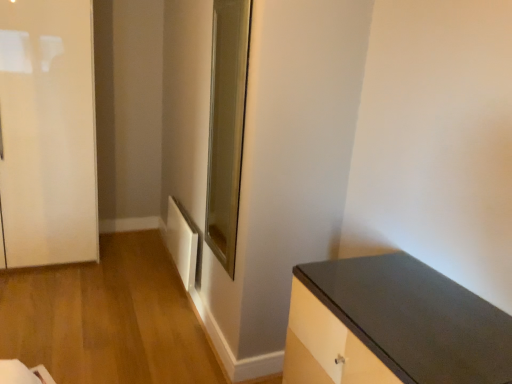
Question: From the image's perspective, is matte black countertop at lower right positioned above or below clear glass door at center?

Choices:
 (A) below
 (B) above

Answer: (A)

Question: Is matte black countertop at lower right spatially inside clear glass door at center, or outside of it?

Choices:
 (A) outside
 (B) inside

Answer: (A)

Question: Which object is positioned closest to the matte black countertop at lower right?

Choices:
 (A) clear glass door at center
 (B) white glossy door at left
 (C) white matte radiator at lower left

Answer: (A)

Question: Which object is positioned farthest from the white matte radiator at lower left?

Choices:
 (A) clear glass door at center
 (B) matte black countertop at lower right
 (C) white glossy door at left

Answer: (B)